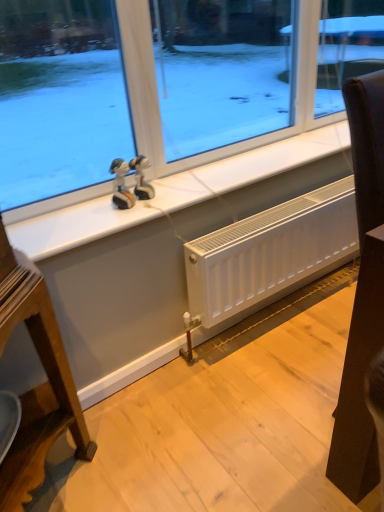
Identify the location of free spot to the right of matte plastic figurine at center, which ranks as the 1th figurine in left-to-right order. (170, 198).